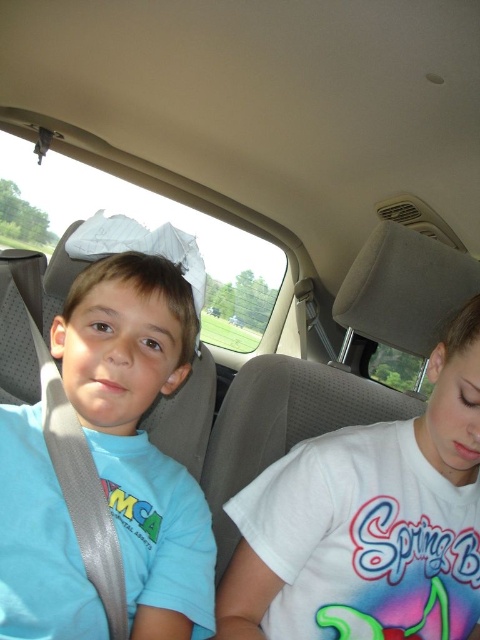
You are sitting in the back seat of the car and want to reach a toy located at point (432, 477). To do so, you need to move past another point (98, 294). Based on the car interior, which direction should you move first to reach the toy?

You should move backward first because point (432, 477) is behind point (98, 294) in the car interior.

You are a passenger in the car and want to hand a toy to the child wearing the white cotton shirt at right. The toy is currently at point (369,522). Which direction should you move the toy to give it to the child?

The white cotton shirt at right is located at point (369,522), so you should move the toy towards that point to give it to the child.